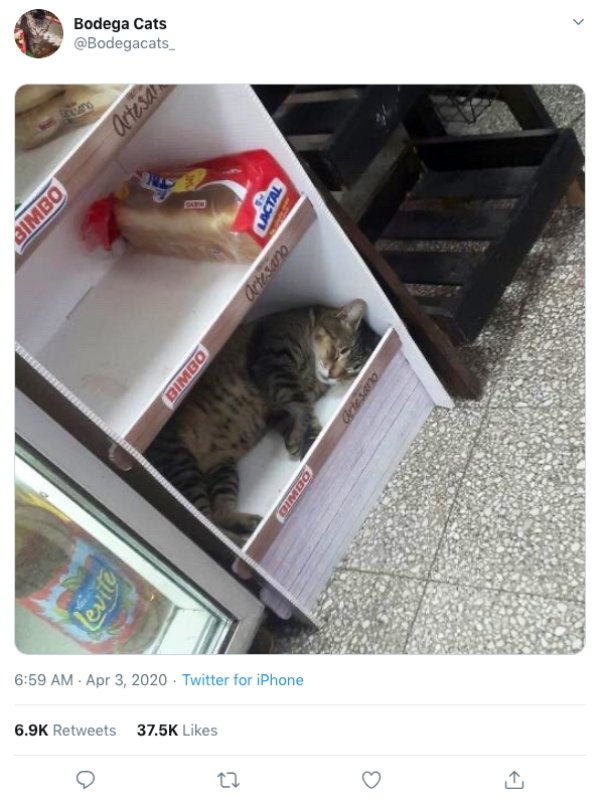
This screenshot has width=600, height=803. In order to click on display shelves in this screenshot , I will do tap(353, 475).